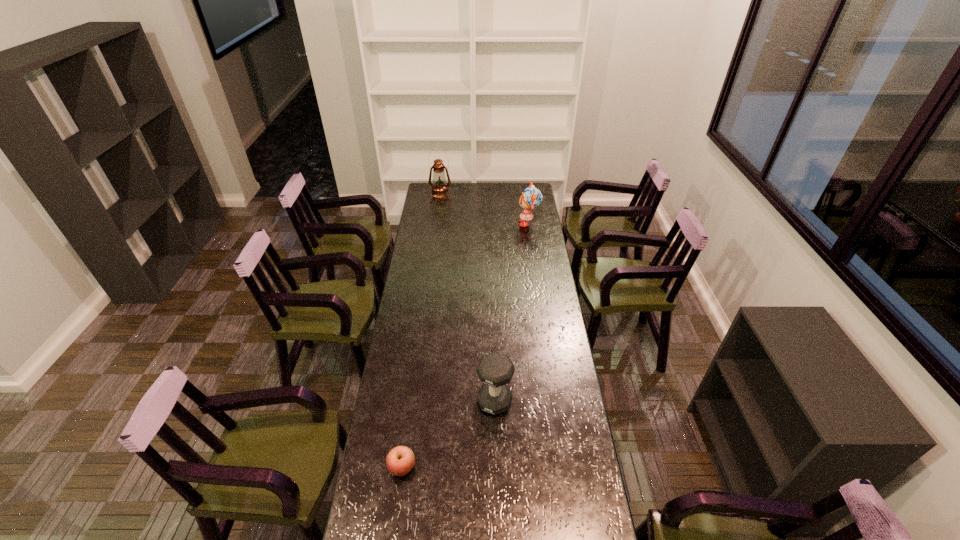
The image size is (960, 540). In the image, there is a desktop. In order to click on vacant space at the left edge in this screenshot , I will do `click(420, 283)`.

Locate an element on the screen. blank space at the right edge is located at coordinates (532, 247).

This screenshot has height=540, width=960. Find the location of `blank region between the rightmost object and the oil lamp`. blank region between the rightmost object and the oil lamp is located at coordinates (485, 208).

Where is `unoccupied position between the shortest object and the second object from right to left`? The image size is (960, 540). unoccupied position between the shortest object and the second object from right to left is located at coordinates (448, 434).

Where is `free space between the dumbbell and the oil lamp`? This screenshot has width=960, height=540. free space between the dumbbell and the oil lamp is located at coordinates (468, 297).

Where is `blank region between the doll and the oil lamp`? The width and height of the screenshot is (960, 540). blank region between the doll and the oil lamp is located at coordinates (485, 208).

Image resolution: width=960 pixels, height=540 pixels. In order to click on empty space that is in between the oil lamp and the rightmost object in this screenshot , I will do `click(485, 208)`.

At what (x,y) coordinates should I click in order to perform the action: click on vacant space in between the apple and the second nearest object. Please return your answer as a coordinate pair (x, y). Looking at the image, I should click on (448, 434).

Where is `vacant point located between the second object from right to left and the nearest object`? The image size is (960, 540). vacant point located between the second object from right to left and the nearest object is located at coordinates (448, 434).

Identify the location of blank region between the shortest object and the second object from right to left. This screenshot has height=540, width=960. (448, 434).